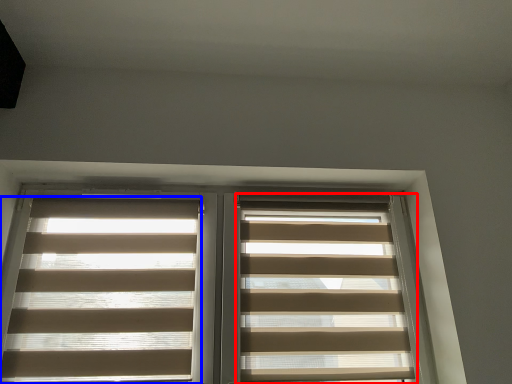
Question: Which of the following is the farthest to the observer, window blind (highlighted by a red box) or window blind (highlighted by a blue box)?

Choices:
 (A) window blind
 (B) window blind

Answer: (A)